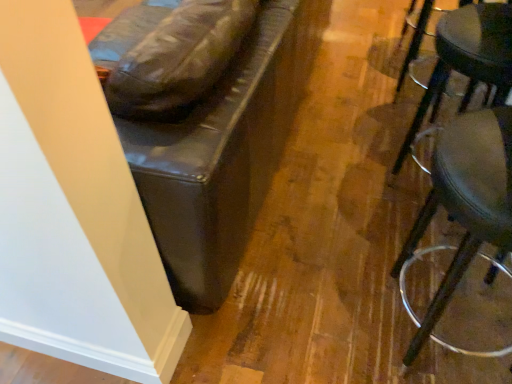
Find the location of a particular element. This screenshot has width=512, height=384. metallic silver stool at right, which ranks as the 2th stool in top-to-bottom order is located at coordinates [x=465, y=201].

Describe the element at coordinates (465, 201) in the screenshot. I see `metallic silver stool at right, which ranks as the 2th stool in top-to-bottom order` at that location.

Measure the distance between metallic silver stool at right, positioned as the 1th stool in bottom-to-top order, and camera.

metallic silver stool at right, positioned as the 1th stool in bottom-to-top order, is 29.03 inches away from camera.

Measure the distance between point (446,202) and camera.

32.28 inches.

Find the location of a particular element. This screenshot has width=512, height=384. metallic silver stool at right, the 1th stool positioned from the top is located at coordinates (467, 55).

Image resolution: width=512 pixels, height=384 pixels. What do you see at coordinates (467, 55) in the screenshot?
I see `metallic silver stool at right, acting as the second stool starting from the bottom` at bounding box center [467, 55].

At what (x,y) coordinates should I click in order to perform the action: click on metallic silver stool at right, positioned as the 1th stool in bottom-to-top order. Please return your answer as a coordinate pair (x, y). This screenshot has width=512, height=384. Looking at the image, I should click on (465, 201).

Consider the image. Does metallic silver stool at right, acting as the second stool starting from the bottom, appear on the left side of metallic silver stool at right, which ranks as the 2th stool in top-to-bottom order?

No.

Between metallic silver stool at right, the 1th stool positioned from the top, and metallic silver stool at right, positioned as the 1th stool in bottom-to-top order, which one is positioned in front?

metallic silver stool at right, positioned as the 1th stool in bottom-to-top order, is in front.

Which is closer, (453, 51) or (465, 170)?

Point (453, 51) appears to be farther away from the viewer than point (465, 170).

From the image's perspective, is metallic silver stool at right, acting as the second stool starting from the bottom, over metallic silver stool at right, which ranks as the 2th stool in top-to-bottom order?

Indeed, from the image's perspective, metallic silver stool at right, acting as the second stool starting from the bottom, is shown above metallic silver stool at right, which ranks as the 2th stool in top-to-bottom order.

From a real-world perspective, is metallic silver stool at right, acting as the second stool starting from the bottom, physically above metallic silver stool at right, positioned as the 1th stool in bottom-to-top order?

No, from a real-world perspective, metallic silver stool at right, acting as the second stool starting from the bottom, is not over metallic silver stool at right, positioned as the 1th stool in bottom-to-top order

Is metallic silver stool at right, the 1th stool positioned from the top, thinner than metallic silver stool at right, which ranks as the 2th stool in top-to-bottom order?

Correct, the width of metallic silver stool at right, the 1th stool positioned from the top, is less than that of metallic silver stool at right, which ranks as the 2th stool in top-to-bottom order.

Which of these two, metallic silver stool at right, the 1th stool positioned from the top, or metallic silver stool at right, positioned as the 1th stool in bottom-to-top order, stands taller?

With more height is metallic silver stool at right, positioned as the 1th stool in bottom-to-top order.

Which of these two, metallic silver stool at right, acting as the second stool starting from the bottom, or metallic silver stool at right, which ranks as the 2th stool in top-to-bottom order, is smaller?

With smaller size is metallic silver stool at right, acting as the second stool starting from the bottom.

Is metallic silver stool at right, the 1th stool positioned from the top, spatially inside metallic silver stool at right, which ranks as the 2th stool in top-to-bottom order, or outside of it?

metallic silver stool at right, the 1th stool positioned from the top, lies outside metallic silver stool at right, which ranks as the 2th stool in top-to-bottom order.

Are metallic silver stool at right, acting as the second stool starting from the bottom, and metallic silver stool at right, positioned as the 1th stool in bottom-to-top order, located far from each other?

No, there isn't a large distance between metallic silver stool at right, acting as the second stool starting from the bottom, and metallic silver stool at right, positioned as the 1th stool in bottom-to-top order.

Is metallic silver stool at right, the 1th stool positioned from the top, positioned with its back to metallic silver stool at right, which ranks as the 2th stool in top-to-bottom order?

No, metallic silver stool at right, the 1th stool positioned from the top,'s orientation is not away from metallic silver stool at right, which ranks as the 2th stool in top-to-bottom order.

Can you tell me how much metallic silver stool at right, the 1th stool positioned from the top, and metallic silver stool at right, positioned as the 1th stool in bottom-to-top order, differ in facing direction?

4.39e-05 degrees.

Where is `stool that appears below the metallic silver stool at right, positioned as the 1th stool in bottom-to-top order (from a real-world perspective)`? The image size is (512, 384). stool that appears below the metallic silver stool at right, positioned as the 1th stool in bottom-to-top order (from a real-world perspective) is located at coordinates (467, 55).

Based on their positions, is metallic silver stool at right, positioned as the 1th stool in bottom-to-top order, located to the left or right of metallic silver stool at right, acting as the second stool starting from the bottom?

metallic silver stool at right, positioned as the 1th stool in bottom-to-top order, is to the left of metallic silver stool at right, acting as the second stool starting from the bottom.

Is the depth of metallic silver stool at right, which ranks as the 2th stool in top-to-bottom order, less than that of metallic silver stool at right, acting as the second stool starting from the bottom?

Yes, the depth of metallic silver stool at right, which ranks as the 2th stool in top-to-bottom order, is less than that of metallic silver stool at right, acting as the second stool starting from the bottom.

Which is behind, point (472, 137) or point (495, 15)?

Positioned behind is point (495, 15).

From the image's perspective, is metallic silver stool at right, which ranks as the 2th stool in top-to-bottom order, under metallic silver stool at right, acting as the second stool starting from the bottom?

Yes, from the image's perspective, metallic silver stool at right, which ranks as the 2th stool in top-to-bottom order, is beneath metallic silver stool at right, acting as the second stool starting from the bottom.

From a real-world perspective, which is physically above, metallic silver stool at right, positioned as the 1th stool in bottom-to-top order, or metallic silver stool at right, the 1th stool positioned from the top?

metallic silver stool at right, positioned as the 1th stool in bottom-to-top order.

Does metallic silver stool at right, which ranks as the 2th stool in top-to-bottom order, have a greater width compared to metallic silver stool at right, the 1th stool positioned from the top?

Indeed, metallic silver stool at right, which ranks as the 2th stool in top-to-bottom order, has a greater width compared to metallic silver stool at right, the 1th stool positioned from the top.

Can you confirm if metallic silver stool at right, which ranks as the 2th stool in top-to-bottom order, is shorter than metallic silver stool at right, the 1th stool positioned from the top?

No, metallic silver stool at right, which ranks as the 2th stool in top-to-bottom order, is not shorter than metallic silver stool at right, the 1th stool positioned from the top.

Considering the relative sizes of metallic silver stool at right, positioned as the 1th stool in bottom-to-top order, and metallic silver stool at right, acting as the second stool starting from the bottom, in the image provided, is metallic silver stool at right, positioned as the 1th stool in bottom-to-top order, bigger than metallic silver stool at right, acting as the second stool starting from the bottom,?

Yes.

Could metallic silver stool at right, acting as the second stool starting from the bottom, be considered to be inside metallic silver stool at right, positioned as the 1th stool in bottom-to-top order?

That's incorrect, metallic silver stool at right, acting as the second stool starting from the bottom, is not inside metallic silver stool at right, positioned as the 1th stool in bottom-to-top order.

Are metallic silver stool at right, which ranks as the 2th stool in top-to-bottom order, and metallic silver stool at right, acting as the second stool starting from the bottom, making contact?

There is a gap between metallic silver stool at right, which ranks as the 2th stool in top-to-bottom order, and metallic silver stool at right, acting as the second stool starting from the bottom.

Is metallic silver stool at right, positioned as the 1th stool in bottom-to-top order, turned away from metallic silver stool at right, acting as the second stool starting from the bottom?

metallic silver stool at right, positioned as the 1th stool in bottom-to-top order, is not turned away from metallic silver stool at right, acting as the second stool starting from the bottom.

Measure the distance between metallic silver stool at right, which ranks as the 2th stool in top-to-bottom order, and metallic silver stool at right, acting as the second stool starting from the bottom.

metallic silver stool at right, which ranks as the 2th stool in top-to-bottom order, is 40.34 centimeters away from metallic silver stool at right, acting as the second stool starting from the bottom.

Image resolution: width=512 pixels, height=384 pixels. What are the coordinates of `stool on the right side of metallic silver stool at right, positioned as the 1th stool in bottom-to-top order` in the screenshot? It's located at (467, 55).

At what (x,y) coordinates should I click in order to perform the action: click on stool behind the metallic silver stool at right, positioned as the 1th stool in bottom-to-top order. Please return your answer as a coordinate pair (x, y). Looking at the image, I should click on (467, 55).

What are the coordinates of `stool below the metallic silver stool at right, the 1th stool positioned from the top (from the image's perspective)` in the screenshot? It's located at (465, 201).